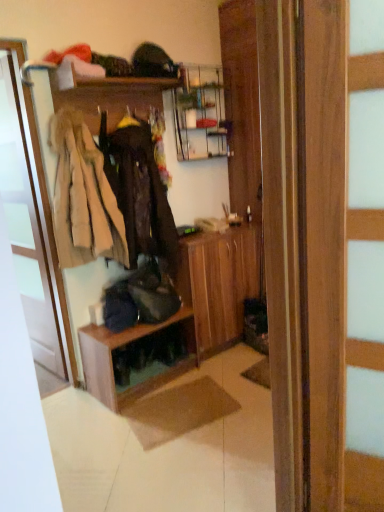
I want to click on empty space that is ontop of beige fur coat at left, the first clothing viewed from the left (from a real-world perspective), so click(56, 95).